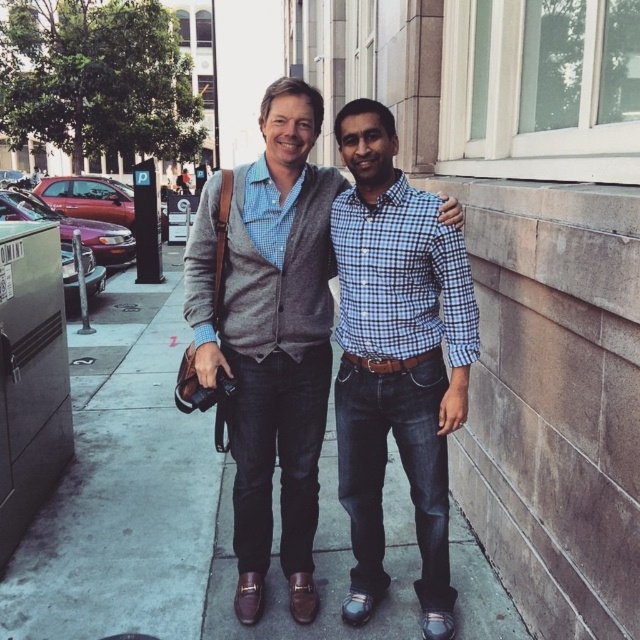
Does dark gray concrete sidewalk at center have a greater height compared to matte gray sweater at center?

No, dark gray concrete sidewalk at center is not taller than matte gray sweater at center.

Can you confirm if dark gray concrete sidewalk at center is bigger than matte gray sweater at center?

No, dark gray concrete sidewalk at center is not bigger than matte gray sweater at center.

Who is more forward, (x=152, y=605) or (x=332, y=314)?

Point (x=332, y=314)

Identify the location of dark gray concrete sidewalk at center. The width and height of the screenshot is (640, 640). pyautogui.click(x=173, y=512).

Does point (291, 323) come behind point (445, 320)?

Yes, point (291, 323) is behind point (445, 320).

Does matte gray sweater at center appear on the right side of blue checkered shirt at center?

No, matte gray sweater at center is not to the right of blue checkered shirt at center.

Find the location of `matte gray sweater at center`. matte gray sweater at center is located at coordinates (268, 336).

Measure the distance from dark gray concrete sidewalk at center to blue checkered shirt at center.

The distance of dark gray concrete sidewalk at center from blue checkered shirt at center is 32.74 inches.

Can you confirm if dark gray concrete sidewalk at center is smaller than blue checkered shirt at center?

Yes.

This screenshot has width=640, height=640. In order to click on dark gray concrete sidewalk at center in this screenshot , I will do `click(173, 512)`.